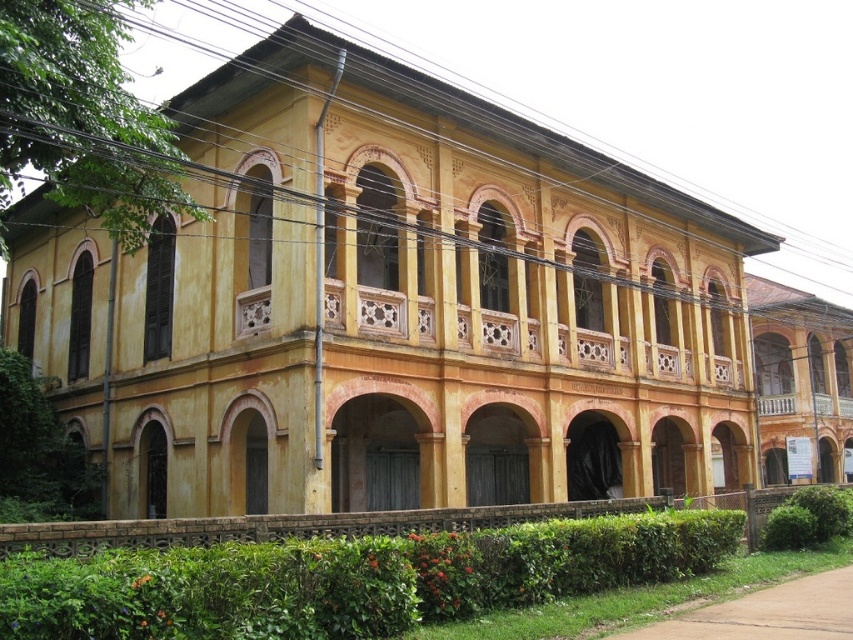
Question: Where is green leafy hedge at lower center located in relation to yellow painted wood at right in the image?

Choices:
 (A) right
 (B) left

Answer: (B)

Question: Can you confirm if green leafy hedge at lower center is positioned to the right of yellow painted wood at right?

Choices:
 (A) yes
 (B) no

Answer: (B)

Question: Can you confirm if yellow painted wood at right is positioned below green leafy hedge at lower right?

Choices:
 (A) yes
 (B) no

Answer: (B)

Question: Which point is closer to the camera taking this photo?

Choices:
 (A) (563, 557)
 (B) (798, 301)
 (C) (828, 525)

Answer: (A)

Question: Which point appears closest to the camera in this image?

Choices:
 (A) (769, 522)
 (B) (77, 634)
 (C) (776, 420)

Answer: (B)

Question: Which point is farther from the camera taking this photo?

Choices:
 (A) (775, 396)
 (B) (65, 561)

Answer: (A)